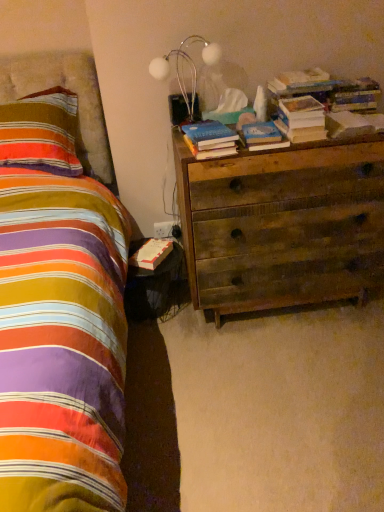
At what (x,y) coordinates should I click in order to perform the action: click on unoccupied area in front of black glossy nightstand at lower left. Please return your answer as a coordinate pair (x, y). Image resolution: width=384 pixels, height=512 pixels. Looking at the image, I should click on (162, 337).